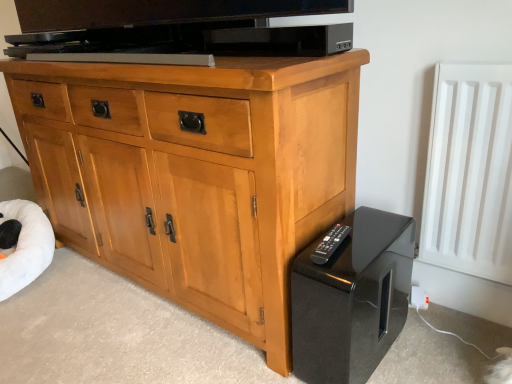
Question: Is point (389, 259) positioned closer to the camera than point (327, 238)?

Choices:
 (A) farther
 (B) closer

Answer: (B)

Question: Is black glossy speaker at lower right taller or shorter than black plastic remote at lower right?

Choices:
 (A) tall
 (B) short

Answer: (A)

Question: Estimate the real-world distances between objects in this image. Which object is closer to the white matte radiator at right?

Choices:
 (A) black plastic remote at lower right
 (B) white plush bean bag at lower left
 (C) black glossy speaker at lower right
 (D) light wood cabinet at center

Answer: (C)

Question: Which object is the farthest from the black glossy speaker at lower right?

Choices:
 (A) white matte radiator at right
 (B) light wood cabinet at center
 (C) white plush bean bag at lower left
 (D) black plastic remote at lower right

Answer: (C)